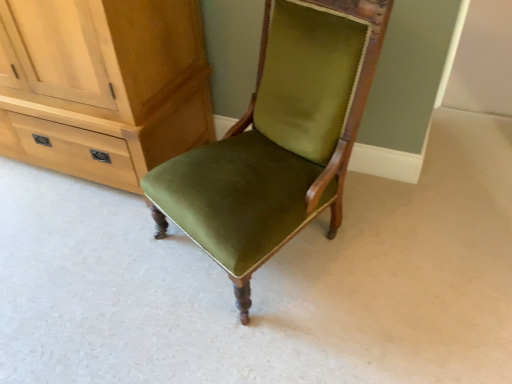
Question: Based on their sizes in the image, would you say matte wood cabinet at left is bigger or smaller than velvet green chair at center?

Choices:
 (A) small
 (B) big

Answer: (B)

Question: From the image's perspective, is matte wood cabinet at left located above or below velvet green chair at center?

Choices:
 (A) above
 (B) below

Answer: (A)

Question: Visually, is matte wood cabinet at left positioned to the left or to the right of velvet green chair at center?

Choices:
 (A) right
 (B) left

Answer: (B)

Question: Considering the positions of velvet green chair at center and matte wood cabinet at left in the image, is velvet green chair at center bigger or smaller than matte wood cabinet at left?

Choices:
 (A) small
 (B) big

Answer: (A)

Question: In terms of width, does velvet green chair at center look wider or thinner when compared to matte wood cabinet at left?

Choices:
 (A) wide
 (B) thin

Answer: (A)

Question: Choose the correct answer: Is velvet green chair at center inside matte wood cabinet at left or outside it?

Choices:
 (A) outside
 (B) inside

Answer: (A)

Question: From the image's perspective, is velvet green chair at center located above or below matte wood cabinet at left?

Choices:
 (A) above
 (B) below

Answer: (B)